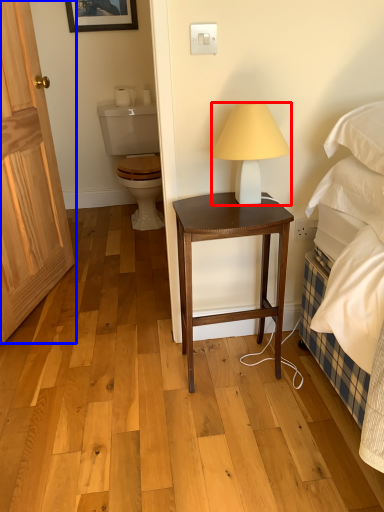
Question: Which of the following is the closest to the observer, lamp (highlighted by a red box) or door (highlighted by a blue box)?

Choices:
 (A) lamp
 (B) door

Answer: (A)